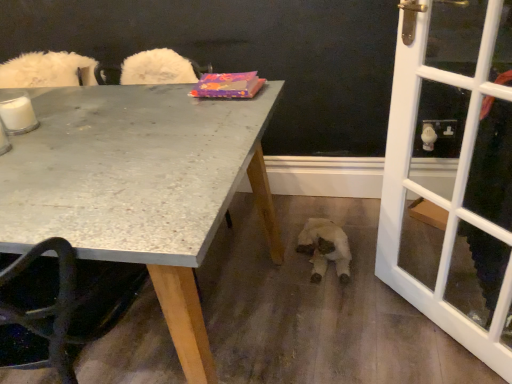
This screenshot has height=384, width=512. Identify the location of blank area to the left of white glass screen door at right. (358, 323).